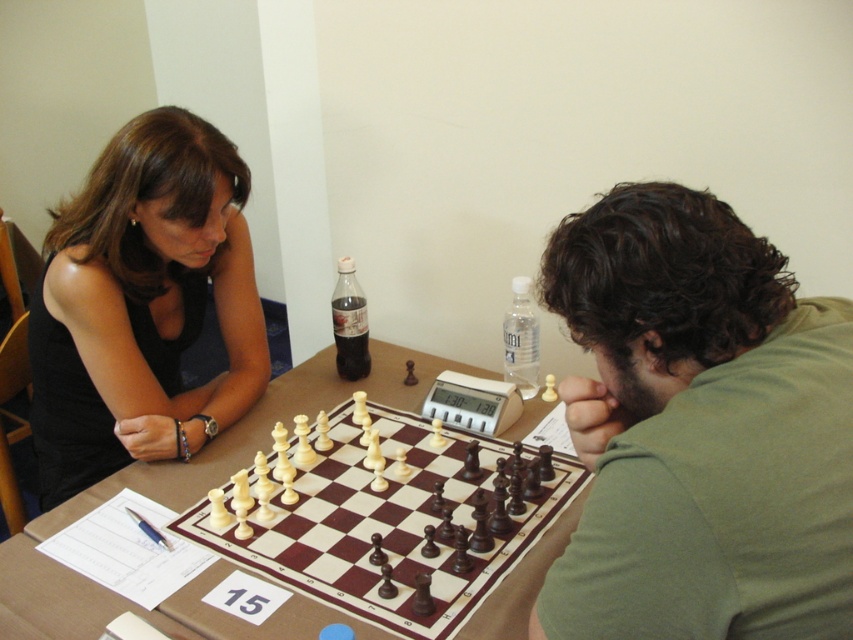
Question: Which of these objects is positioned farthest from the black fabric shirt at upper left?

Choices:
 (A) transparent plastic water bottle at center
 (B) brown wooden table at center
 (C) green matte shirt at center

Answer: (C)

Question: Can you confirm if green matte shirt at center is positioned above black fabric shirt at upper left?

Choices:
 (A) yes
 (B) no

Answer: (B)

Question: Can you confirm if green matte shirt at center is thinner than brown wooden table at center?

Choices:
 (A) no
 (B) yes

Answer: (B)

Question: Among these points, which one is nearest to the camera?

Choices:
 (A) click(x=851, y=388)
 (B) click(x=364, y=372)

Answer: (A)

Question: Which is farther from the transparent plastic water bottle at center?

Choices:
 (A) black fabric shirt at upper left
 (B) green matte shirt at center

Answer: (B)

Question: Does green matte shirt at center appear over dark glass bottle at center?

Choices:
 (A) no
 (B) yes

Answer: (A)